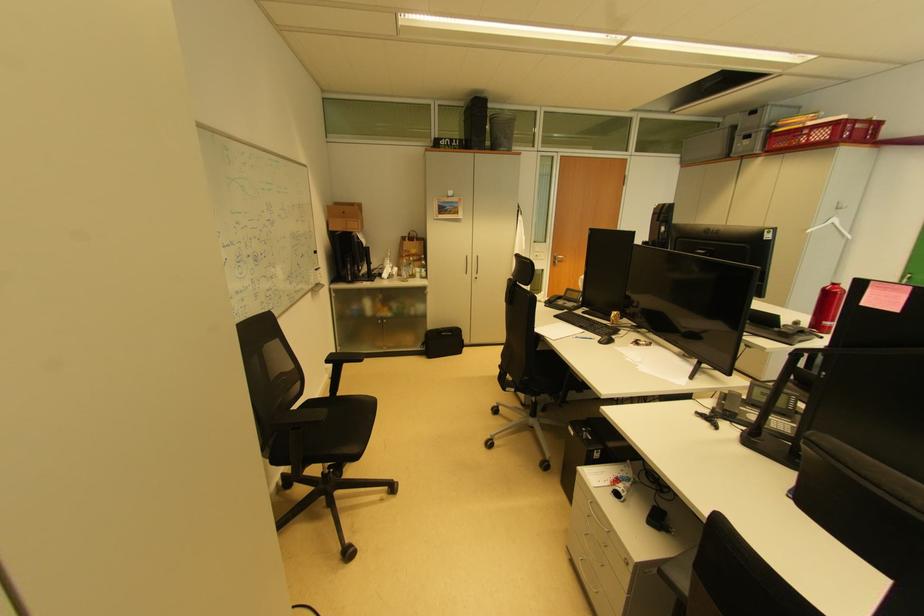
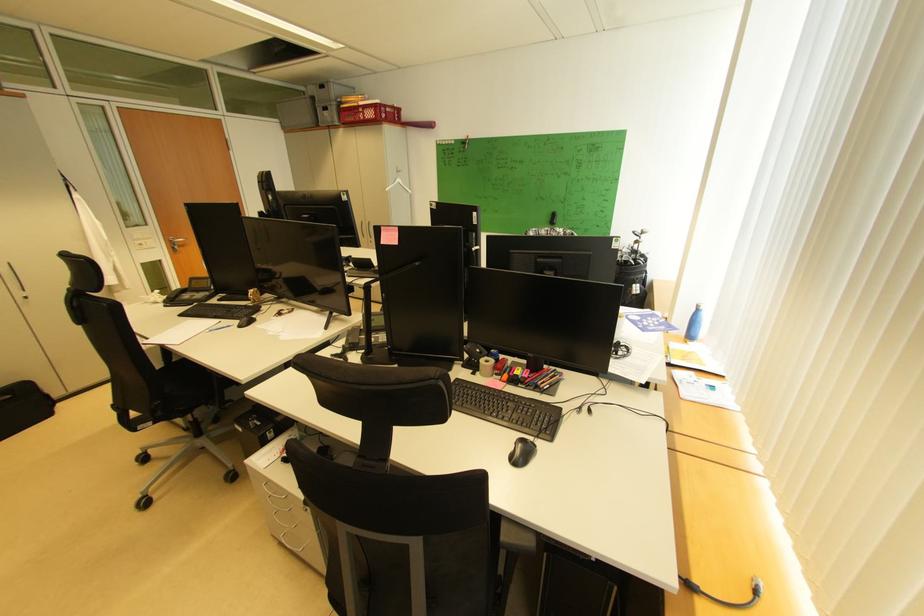
Find the pixel in the second image that matches [817,140] in the first image.

(372, 118)